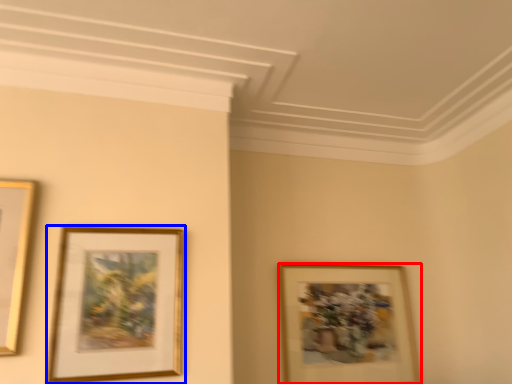
Question: Among these objects, which one is farthest to the camera, picture frame (highlighted by a red box) or picture frame (highlighted by a blue box)?

Choices:
 (A) picture frame
 (B) picture frame

Answer: (A)